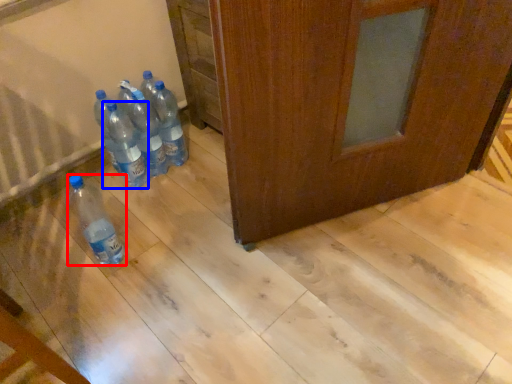
Question: Which object is closer to the camera taking this photo, bottle (highlighted by a red box) or bottle (highlighted by a blue box)?

Choices:
 (A) bottle
 (B) bottle

Answer: (A)